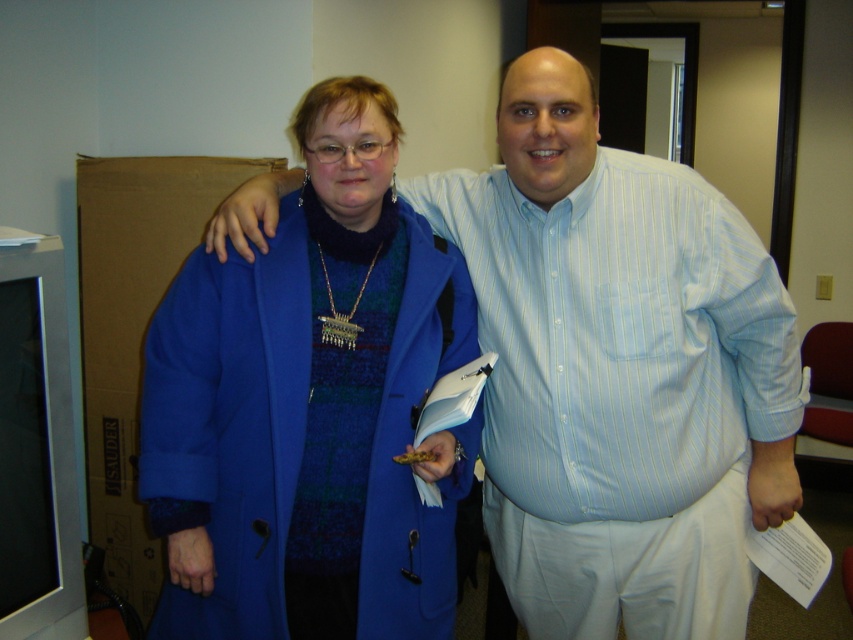
Question: Does light blue striped shirt at center come in front of blue wool coat at center?

Choices:
 (A) no
 (B) yes

Answer: (A)

Question: Does light blue striped shirt at center have a larger size compared to blue wool coat at center?

Choices:
 (A) no
 (B) yes

Answer: (B)

Question: Can you confirm if light blue striped shirt at center is thinner than blue wool coat at center?

Choices:
 (A) no
 (B) yes

Answer: (A)